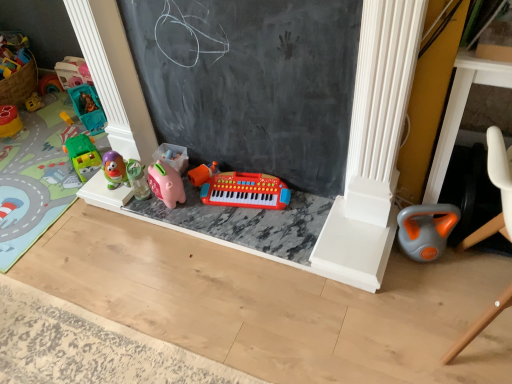
Where is `free space in front of gray-orange plastic kettlebell at lower right, acting as the 7th toy starting from the left`? This screenshot has height=384, width=512. free space in front of gray-orange plastic kettlebell at lower right, acting as the 7th toy starting from the left is located at coordinates (437, 292).